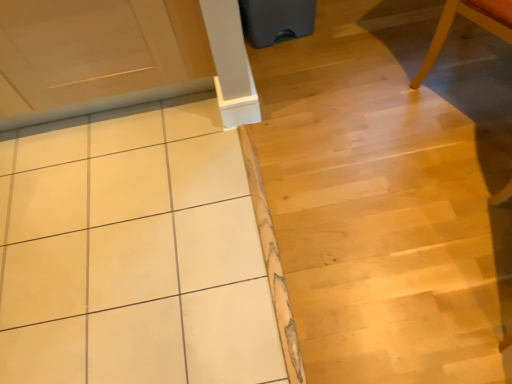
Identify the location of white tile at upper left. The image size is (512, 384). (390, 193).

Identify the location of white tile at upper left. (390, 193).

Is light wood chair at upper right shorter than white glossy tile at center?

No.

From the image's perspective, who appears lower, light wood chair at upper right or white glossy tile at center?

white glossy tile at center.

Is point (485, 20) closer or farther from the camera than point (133, 341)?

Point (485, 20) is closer to the camera than point (133, 341).

Can you confirm if light wood chair at upper right is positioned to the right of white glossy tile at center?

→ Indeed, light wood chair at upper right is positioned on the right side of white glossy tile at center.

Is light wood chair at upper right next to white tile at upper left?

No, light wood chair at upper right is not next to white tile at upper left.

From a real-world perspective, who is located higher, light wood chair at upper right or white tile at upper left?

From a 3D spatial view, light wood chair at upper right is above.

Does light wood chair at upper right have a larger size compared to white tile at upper left?

No.

Between light wood chair at upper right and white tile at upper left, which one has larger width?

With larger width is white tile at upper left.

Consider the image. Is white tile at upper left taller or shorter than light wood chair at upper right?

Clearly, white tile at upper left is shorter compared to light wood chair at upper right.

Between white tile at upper left and light wood chair at upper right, which one has smaller size?

light wood chair at upper right is smaller.

Would you consider white tile at upper left to be distant from light wood chair at upper right?

Actually, white tile at upper left and light wood chair at upper right are a little close together.

From a real-world perspective, is white tile at upper left beneath light wood chair at upper right?

Correct, in the physical world, white tile at upper left is lower than light wood chair at upper right.

Could light wood chair at upper right be considered to be inside white glossy tile at center?

That's incorrect, light wood chair at upper right is not inside white glossy tile at center.

Does white glossy tile at center have a smaller size compared to light wood chair at upper right?

Yes.

How different are the orientations of white glossy tile at center and light wood chair at upper right in degrees?

56.9 degrees.

Are white glossy tile at center and light wood chair at upper right located far from each other?

Yes.

Considering the positions of objects white tile at upper left and white glossy tile at center in the image provided, who is in front, white tile at upper left or white glossy tile at center?

Positioned in front is white tile at upper left.

Who is taller, white tile at upper left or white glossy tile at center?

white tile at upper left is taller.

Is white tile at upper left far away from white glossy tile at center?

They are positioned close to each other.

At what (x,y) coordinates should I click in order to perform the action: click on ceramic tile above the white tile at upper left (from a real-world perspective). Please return your answer as a coordinate pair (x, y). This screenshot has height=384, width=512. Looking at the image, I should click on (133, 252).

Can you confirm if white glossy tile at center is bigger than white tile at upper left?

Actually, white glossy tile at center might be smaller than white tile at upper left.

Locate an element on the screen. The height and width of the screenshot is (384, 512). ceramic tile above the white tile at upper left (from a real-world perspective) is located at coordinates (133, 252).

Is white glossy tile at center in front of or behind white tile at upper left in the image?

Visually, white glossy tile at center is located behind white tile at upper left.

Does white glossy tile at center appear on the right side of white tile at upper left?

No, white glossy tile at center is not to the right of white tile at upper left.

Find the location of `ceramic tile directly beneath the light wood chair at upper right (from a real-world perspective)`. ceramic tile directly beneath the light wood chair at upper right (from a real-world perspective) is located at coordinates (133, 252).

Identify the location of stair located behind the light wood chair at upper right. (390, 193).

Estimate the real-world distances between objects in this image. Which object is closer to white glossy tile at center, white tile at upper left or light wood chair at upper right?

The object closer to white glossy tile at center is white tile at upper left.

From the picture: When comparing their distances from white tile at upper left, does white glossy tile at center or light wood chair at upper right seem closer?

Among the two, light wood chair at upper right is located nearer to white tile at upper left.

From the image, which object appears to be nearer to light wood chair at upper right, white glossy tile at center or white tile at upper left?

The object closer to light wood chair at upper right is white tile at upper left.

Based on their spatial positions, is light wood chair at upper right or white glossy tile at center further from white tile at upper left?

white glossy tile at center is positioned further to the anchor white tile at upper left.

Which object lies further to the anchor point white glossy tile at center, light wood chair at upper right or white tile at upper left?

light wood chair at upper right lies further to white glossy tile at center than the other object.

From the image, which object appears to be farther from light wood chair at upper right, white tile at upper left or white glossy tile at center?

The object further to light wood chair at upper right is white glossy tile at center.

This screenshot has height=384, width=512. In order to click on stair between white glossy tile at center and light wood chair at upper right in this screenshot , I will do `click(390, 193)`.